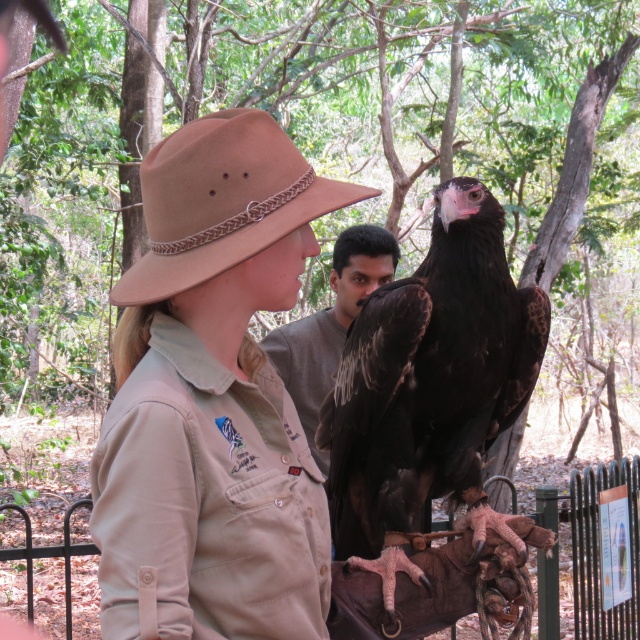
Question: Where is tan canvas hat at upper left located in relation to dark gray shirt at center in the image?

Choices:
 (A) right
 (B) left

Answer: (B)

Question: Which of the following is the closest to the observer?

Choices:
 (A) (301, 426)
 (B) (131, 403)
 (C) (456, 192)

Answer: (B)

Question: Which object appears farthest from the camera in this image?

Choices:
 (A) dark gray shirt at center
 (B) dark brown feathers at center

Answer: (A)

Question: Is tan canvas hat at upper left closer to the viewer compared to dark brown feathers at center?

Choices:
 (A) no
 (B) yes

Answer: (B)

Question: Which of these objects is positioned closest to the tan canvas hat at upper left?

Choices:
 (A) dark brown feathers at center
 (B) dark gray shirt at center

Answer: (A)

Question: Is tan canvas hat at upper left to the left of dark brown feathers at center from the viewer's perspective?

Choices:
 (A) no
 (B) yes

Answer: (B)